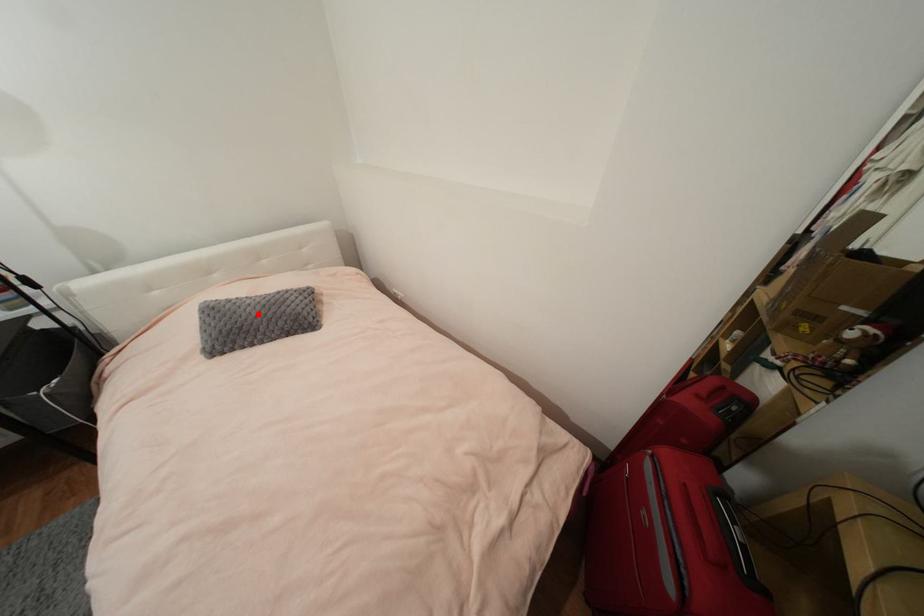
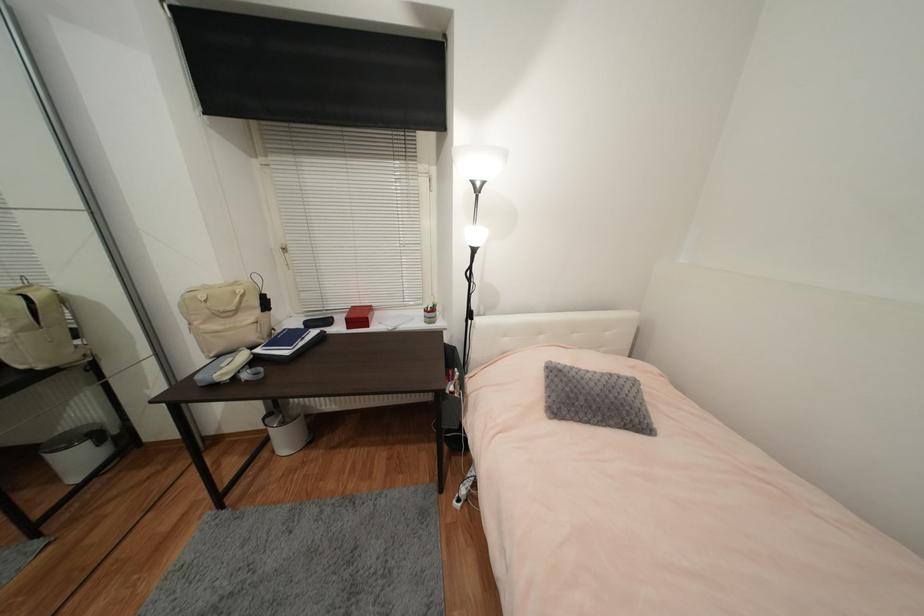
Locate, in the second image, the point that corresponds to the highlighted location in the first image.

(602, 391)